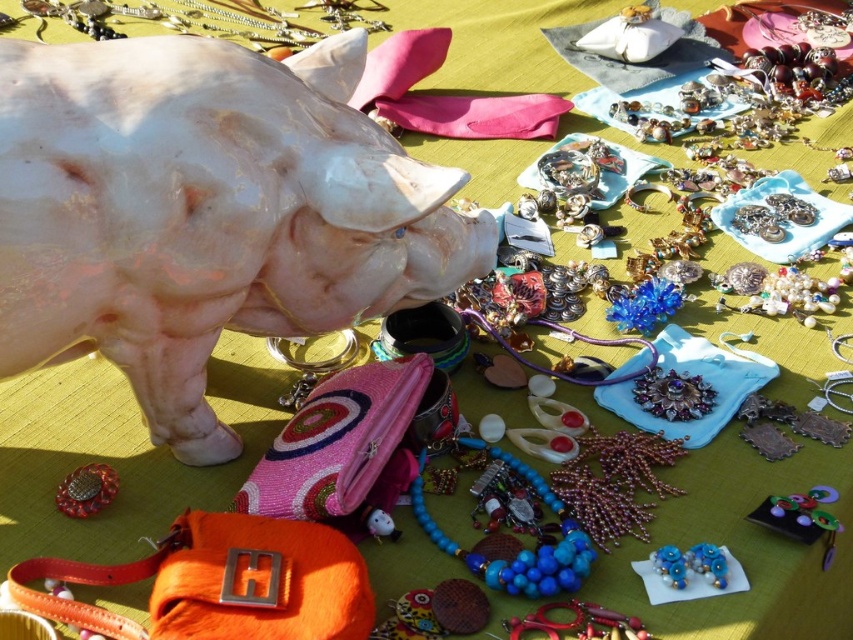
Question: Where is blue beaded necklace at center located in relation to blue beaded earrings at lower right in the image?

Choices:
 (A) below
 (B) above

Answer: (B)

Question: Which object is closer to the camera taking this photo?

Choices:
 (A) blue beaded earrings at lower right
 (B) blue beaded necklace at center
 (C) white glossy pig at upper left

Answer: (C)

Question: Is blue beaded necklace at center thinner than blue beaded earrings at lower right?

Choices:
 (A) yes
 (B) no

Answer: (B)

Question: Estimate the real-world distances between objects in this image. Which object is farther from the blue beaded earrings at lower right?

Choices:
 (A) white glossy pig at upper left
 (B) blue beaded necklace at center

Answer: (A)

Question: Which is nearer to the blue beaded necklace at center?

Choices:
 (A) blue beaded earrings at lower right
 (B) white glossy pig at upper left

Answer: (A)

Question: Can you confirm if white glossy pig at upper left is positioned below blue beaded necklace at center?

Choices:
 (A) no
 (B) yes

Answer: (A)